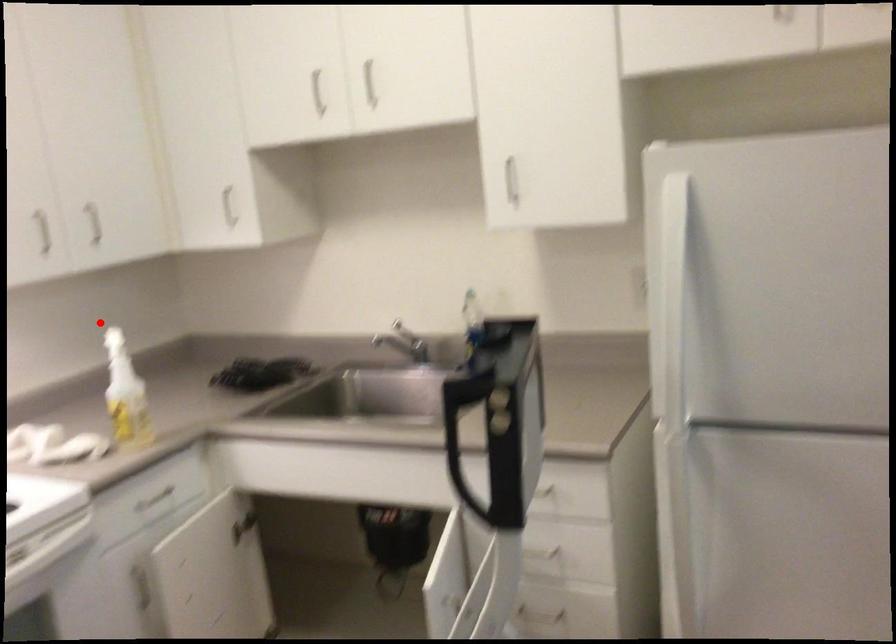
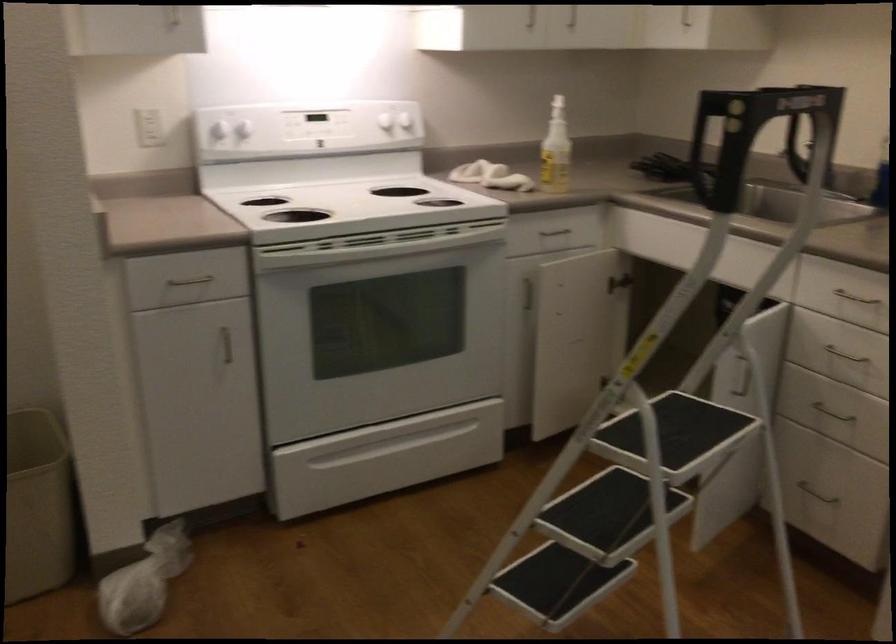
The point at the highlighted location is marked in the first image. Where is the corresponding point in the second image?

(557, 97)